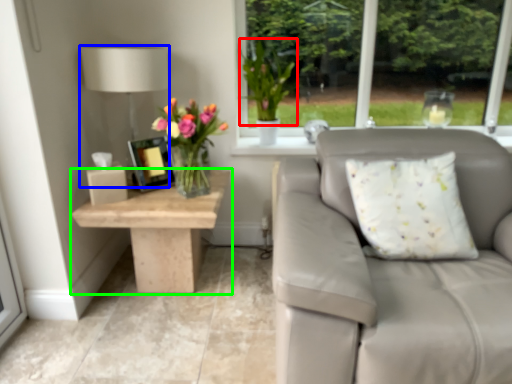
Question: Which is nearer to the floral arrangement (highlighted by a red box)? table lamp (highlighted by a blue box) or table (highlighted by a green box).

Choices:
 (A) table lamp
 (B) table

Answer: (A)